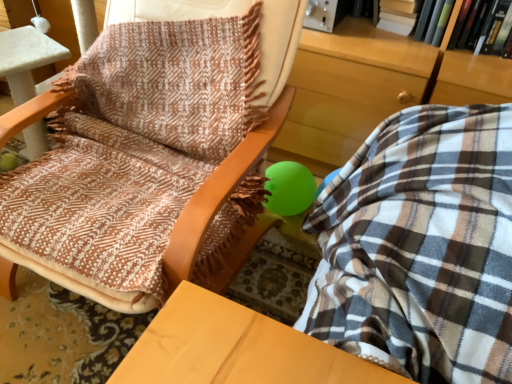
Question: Considering their positions, is green matte book at upper right, acting as the 2th book starting from the left, located in front of or behind brown woven fabric at center?

Choices:
 (A) front
 (B) behind

Answer: (B)

Question: Is green matte book at upper right, acting as the 2th book starting from the left, to the left or to the right of brown woven fabric at center in the image?

Choices:
 (A) left
 (B) right

Answer: (B)

Question: Estimate the real-world distances between objects in this image. Which object is farther from the hardcover book at upper right, which appears as the third book when viewed from the left?

Choices:
 (A) white paper book at upper right, which appears as the 1th book when viewed from the left
 (B) green matte book at upper right, the 2th book from the right
 (C) brown woven fabric at center

Answer: (C)

Question: Considering the real-world distances, which object is closest to the green matte book at upper right, the 2th book from the right?

Choices:
 (A) white paper book at upper right, which appears as the 1th book when viewed from the left
 (B) brown woven fabric at center
 (C) hardcover book at upper right, which appears as the third book when viewed from the left

Answer: (C)